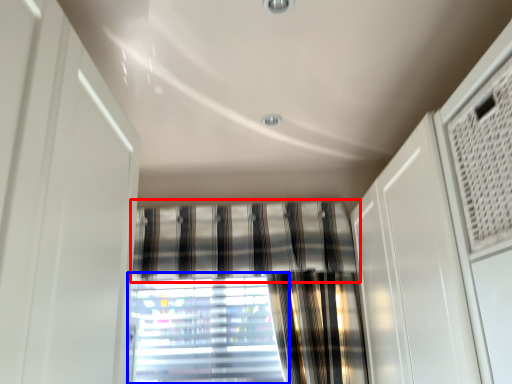
Question: Which point is closer to the camera, curtain (highlighted by a red box) or window (highlighted by a blue box)?

Choices:
 (A) curtain
 (B) window

Answer: (A)